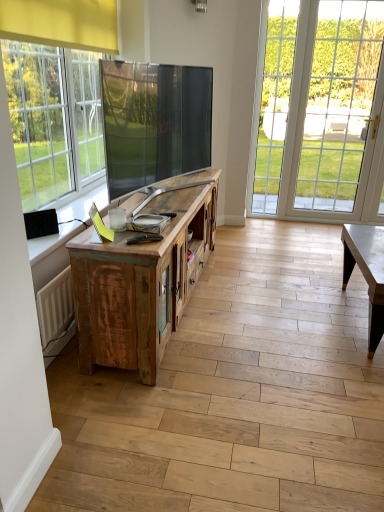
This screenshot has width=384, height=512. Describe the element at coordinates (140, 281) in the screenshot. I see `weathered wood cabinet at center` at that location.

Identify the location of weathered wood cabinet at center. coord(140,281).

Image resolution: width=384 pixels, height=512 pixels. What do you see at coordinates (272, 106) in the screenshot?
I see `clear glass door at right` at bounding box center [272, 106].

I want to click on clear glass door at right, so click(272, 106).

In order to face clear glass door at right, should I rotate leftwards or rightwards?

A 10.709 degree turn to the right will do.

The height and width of the screenshot is (512, 384). I want to click on weathered wood cabinet at center, so click(x=140, y=281).

Considering the relative positions of clear glass door at right and weathered wood cabinet at center in the image provided, is clear glass door at right to the left of weathered wood cabinet at center from the viewer's perspective?

Incorrect, clear glass door at right is not on the left side of weathered wood cabinet at center.

Which is in front, clear glass door at right or weathered wood cabinet at center?

weathered wood cabinet at center is more forward.

Is point (261, 173) less distant than point (175, 268)?

That is False.

From the image's perspective, relative to weathered wood cabinet at center, is clear glass door at right above or below?

From the image's perspective, clear glass door at right appears above weathered wood cabinet at center.

From a real-world perspective, is clear glass door at right positioned under weathered wood cabinet at center based on gravity?

No.

Considering the relative sizes of clear glass door at right and weathered wood cabinet at center in the image provided, is clear glass door at right thinner than weathered wood cabinet at center?

Yes, clear glass door at right is thinner than weathered wood cabinet at center.

Does clear glass door at right have a greater height compared to weathered wood cabinet at center?

Yes, clear glass door at right is taller than weathered wood cabinet at center.

Considering the sizes of clear glass door at right and weathered wood cabinet at center in the image, is clear glass door at right bigger or smaller than weathered wood cabinet at center?

Clearly, clear glass door at right is smaller in size than weathered wood cabinet at center.

Is weathered wood cabinet at center located within clear glass door at right?

No, weathered wood cabinet at center is not inside clear glass door at right.

Is clear glass door at right in contact with weathered wood cabinet at center?

No, clear glass door at right is not making contact with weathered wood cabinet at center.

Could you tell me if clear glass door at right is facing weathered wood cabinet at center?

No, clear glass door at right is not facing towards weathered wood cabinet at center.

In order to click on cabinetry below the clear glass door at right (from a real-world perspective) in this screenshot , I will do 140,281.

Based on their positions, is weathered wood cabinet at center located to the left or right of clear glass door at right?

Based on their positions, weathered wood cabinet at center is located to the left of clear glass door at right.

Which object is further away from the camera, weathered wood cabinet at center or clear glass door at right?

clear glass door at right is behind.

Is point (76, 324) positioned behind point (271, 51)?

That is False.

From the image's perspective, between weathered wood cabinet at center and clear glass door at right, which one is located above?

clear glass door at right is shown above in the image.

From a real-world perspective, which object stands above the other?

clear glass door at right, from a real-world perspective.

Which of these two, weathered wood cabinet at center or clear glass door at right, is thinner?

With smaller width is clear glass door at right.

Between weathered wood cabinet at center and clear glass door at right, which one has less height?

weathered wood cabinet at center is shorter.

Considering the relative sizes of weathered wood cabinet at center and clear glass door at right in the image provided, is weathered wood cabinet at center smaller than clear glass door at right?

No, weathered wood cabinet at center is not smaller than clear glass door at right.

Would you say weathered wood cabinet at center is inside or outside clear glass door at right?

weathered wood cabinet at center lies outside clear glass door at right.

Looking at this image, is weathered wood cabinet at center positioned far away from clear glass door at right?

Absolutely, weathered wood cabinet at center is distant from clear glass door at right.

Is weathered wood cabinet at center looking in the opposite direction of clear glass door at right?

No, weathered wood cabinet at center's orientation is not away from clear glass door at right.

How different are the orientations of weathered wood cabinet at center and clear glass door at right in degrees?

88.9 degrees.

This screenshot has width=384, height=512. What are the coordinates of `cabinetry below the clear glass door at right (from a real-world perspective)` in the screenshot? It's located at (140, 281).

You are a GUI agent. You are given a task and a screenshot of the screen. Output one action in this format:
    pyautogui.click(x=<x>, y=<y>)
    Task: Click on the cabinetry on the left of the clear glass door at right
    The width and height of the screenshot is (384, 512).
    Given the screenshot: What is the action you would take?
    140,281

Where is `cabinetry that appears below the clear glass door at right (from a real-world perspective)`? cabinetry that appears below the clear glass door at right (from a real-world perspective) is located at coordinates point(140,281).